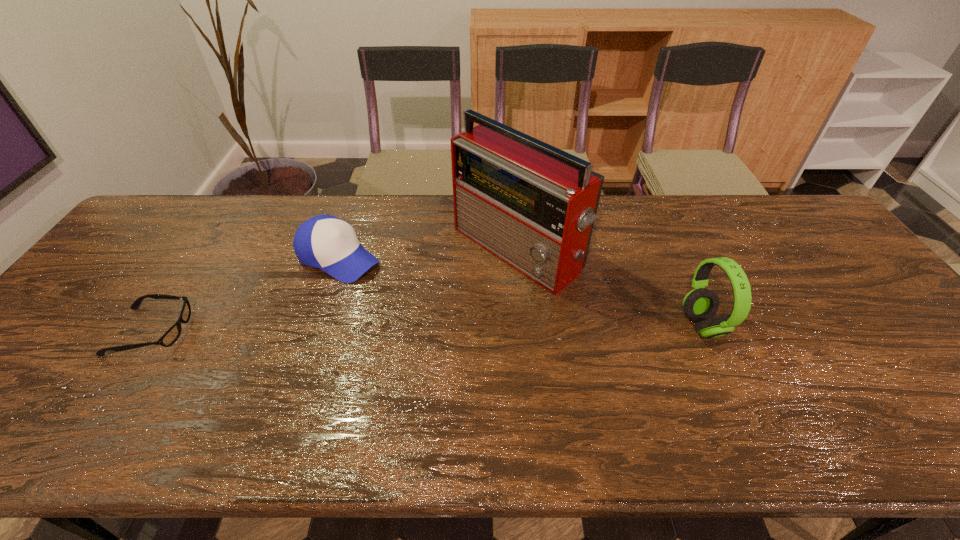
The width and height of the screenshot is (960, 540). I want to click on vacant space located 0.350m on the front-facing side of the tallest object, so click(366, 355).

Where is `free point located on the front-facing side of the tallest object`? Image resolution: width=960 pixels, height=540 pixels. free point located on the front-facing side of the tallest object is located at coordinates (376, 348).

Find the location of a particular element. free spot located on the front-facing side of the tallest object is located at coordinates (393, 336).

Locate an element on the screen. blank space located on the front-facing side of the second object from left to right is located at coordinates (413, 300).

Locate an element on the screen. vacant space located on the front-facing side of the second object from left to right is located at coordinates (453, 325).

The width and height of the screenshot is (960, 540). What are the coordinates of `vacant space positioned 0.260m on the front-facing side of the second object from left to right` in the screenshot? It's located at (438, 316).

Where is `radio receiver located at the far edge`? Image resolution: width=960 pixels, height=540 pixels. radio receiver located at the far edge is located at coordinates (530, 204).

The height and width of the screenshot is (540, 960). What are the coordinates of `baseball cap at the far edge` in the screenshot? It's located at (326, 242).

In the image, there is a desktop. Where is `free space at the far edge`? free space at the far edge is located at coordinates (441, 207).

This screenshot has width=960, height=540. Identify the location of vacant area at the near edge. (441, 408).